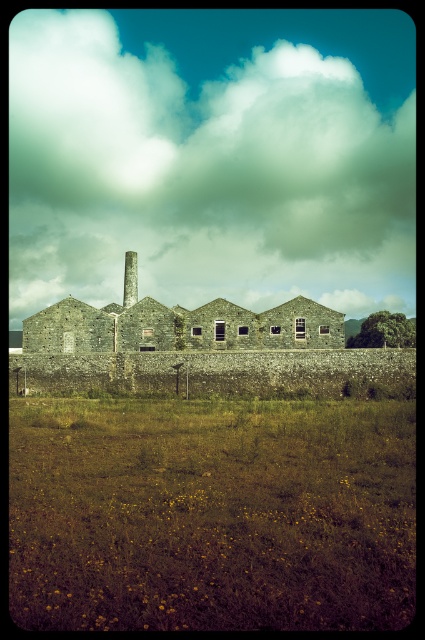
You are standing in front of the old industrial building and looking at the white fluffy cloud at upper center and the green grass at lower center. Which object is higher from the ground?

The white fluffy cloud at upper center is higher from the ground than the green grass at lower center because it is positioned above it.

You are a photographer planning to capture the stone chimney at center against the sky. You notice a white fluffy cloud at upper center. Will the cloud appear larger than the chimney in your photo?

The white fluffy cloud at upper center is bigger than the stone chimney at center, so yes, the cloud will appear larger than the chimney in the photo.

You are standing in front of the old industrial building and looking up at the sky. You notice the white fluffy cloud at upper center and the stone chimney at center. Which one appears taller from your perspective?

The white fluffy cloud at upper center appears taller than the stone chimney at center because it has a greater height compared to the stone chimney at center according to the description.